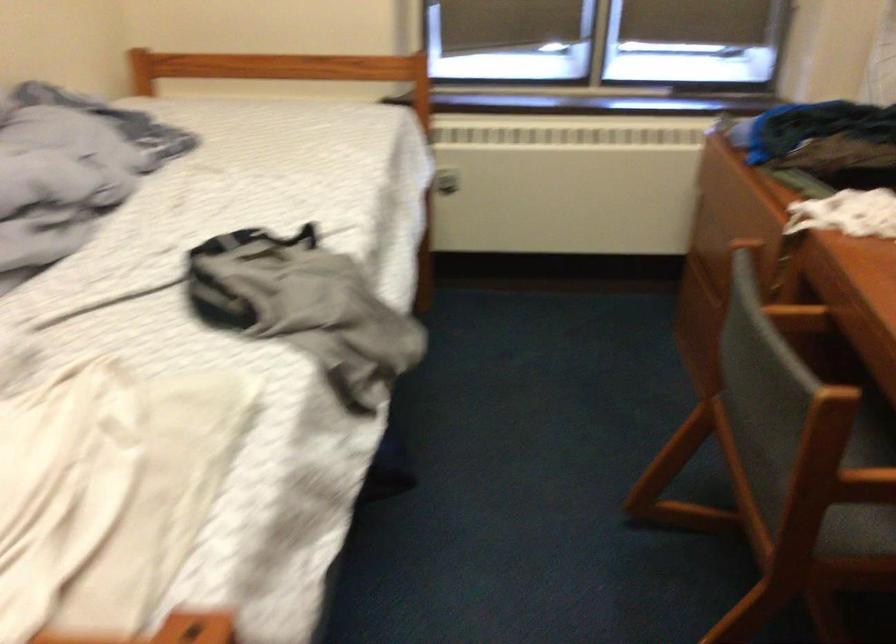
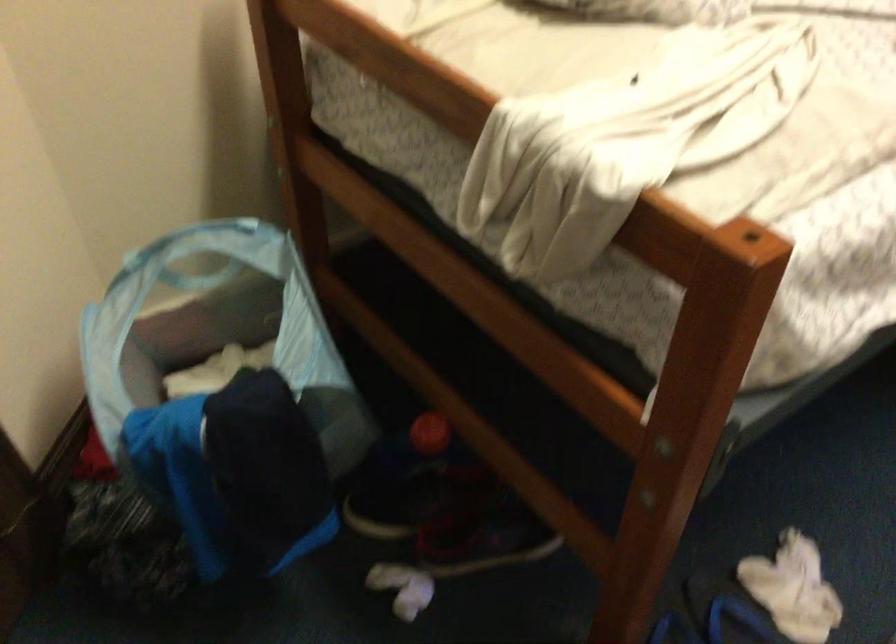
The first image is from the beginning of the video and the second image is from the end. How did the camera likely rotate when shooting the video?

The camera rotated toward left-down.